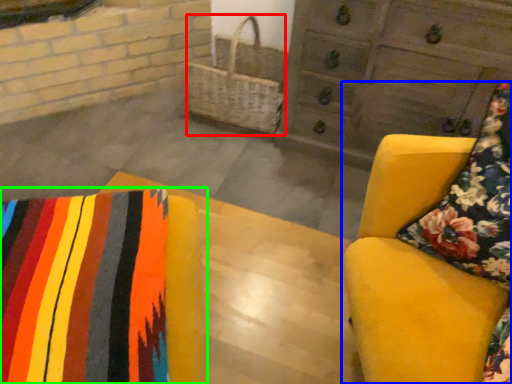
Question: Which is farther away from basket (highlighted by a red box)? furniture (highlighted by a blue box) or furniture (highlighted by a green box)?

Choices:
 (A) furniture
 (B) furniture

Answer: (B)